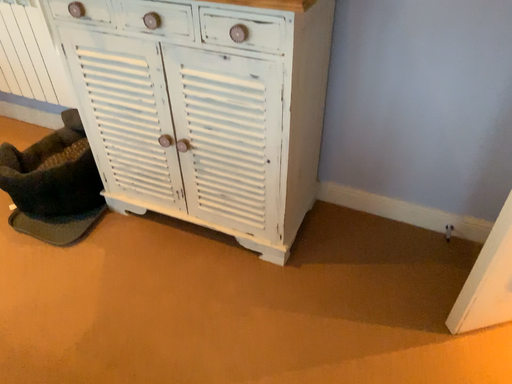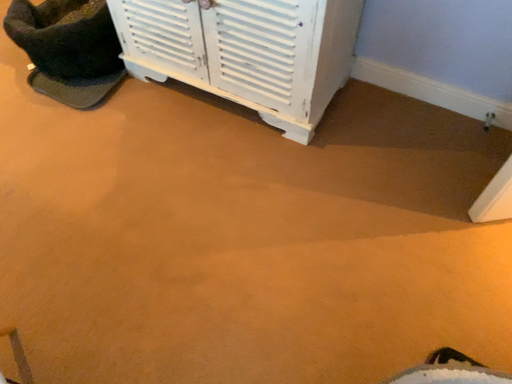
Question: Which way did the camera rotate in the video?

Choices:
 (A) rotated upward
 (B) rotated downward

Answer: (B)